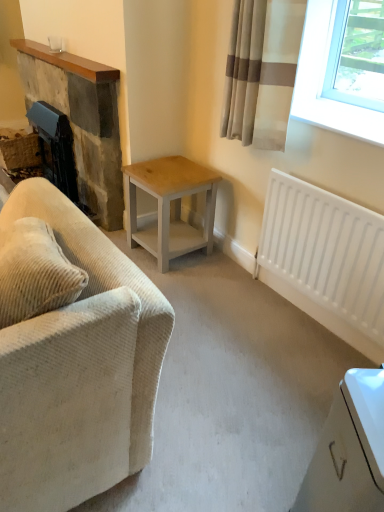
I want to click on free space in front of light wood/grey painted table at center, so click(198, 287).